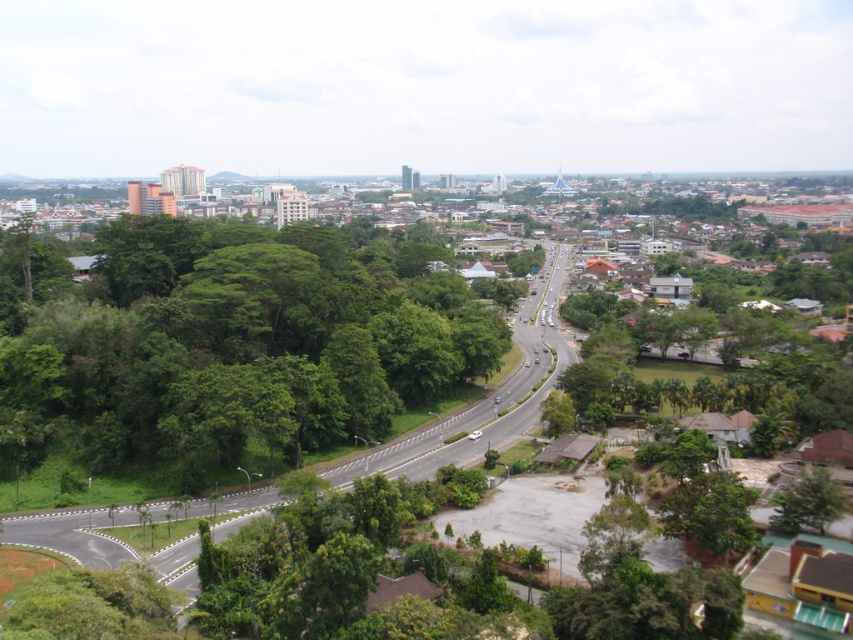
You are standing at the point with coordinates (488, 396) in the cityscape. What do you see directly in front of you?

You see the green leafy highway at center directly in front of you.

You are a pedestrian standing on the sidewalk and want to cross the green leafy highway at center. There is a green leafy tree at lower right nearby. Which object would block your view of the tree if you stand in the middle of the highway?

The green leafy highway at center is in front of the green leafy tree at lower right, so standing in the middle of the highway would block your view of the tree.

You are a drone operator trying to deliver a package to a location near the green leafy highway at center. The drone has a maximum flight range of 70 meters. Can the drone reach the highway?

The green leafy highway at center is 70.93 meters from viewer, which exceeds the drone maximum flight range of 70 meters. The drone cannot reach the highway.